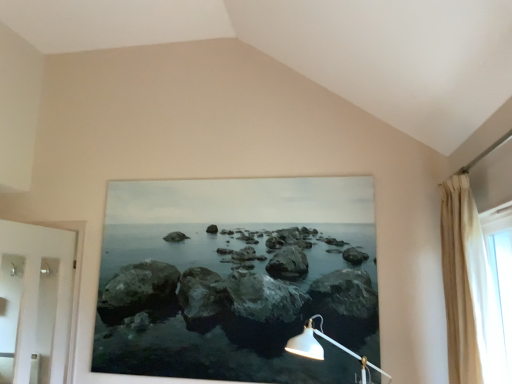
Question: Is beige fabric curtain at right to the right of white glossy door at left from the viewer's perspective?

Choices:
 (A) yes
 (B) no

Answer: (A)

Question: Considering the relative sizes of beige fabric curtain at right and white glossy door at left in the image provided, is beige fabric curtain at right bigger than white glossy door at left?

Choices:
 (A) no
 (B) yes

Answer: (A)

Question: Is beige fabric curtain at right shorter than white glossy door at left?

Choices:
 (A) yes
 (B) no

Answer: (A)

Question: Does beige fabric curtain at right appear on the left side of white glossy door at left?

Choices:
 (A) no
 (B) yes

Answer: (A)

Question: Is beige fabric curtain at right next to white glossy door at left and touching it?

Choices:
 (A) no
 (B) yes

Answer: (A)

Question: Is beige fabric curtain at right closer to the viewer compared to white glossy door at left?

Choices:
 (A) yes
 (B) no

Answer: (A)

Question: Does white glossy door at left have a lesser width compared to beige fabric curtain at right?

Choices:
 (A) no
 (B) yes

Answer: (B)

Question: From the image's perspective, does white glossy door at left appear higher than beige fabric curtain at right?

Choices:
 (A) yes
 (B) no

Answer: (B)

Question: Would you say white glossy door at left is a long distance from beige fabric curtain at right?

Choices:
 (A) no
 (B) yes

Answer: (B)

Question: Is the surface of white glossy door at left in direct contact with beige fabric curtain at right?

Choices:
 (A) no
 (B) yes

Answer: (A)

Question: From a real-world perspective, is white glossy door at left below beige fabric curtain at right?

Choices:
 (A) no
 (B) yes

Answer: (B)

Question: From a real-world perspective, is white glossy door at left positioned over beige fabric curtain at right based on gravity?

Choices:
 (A) no
 (B) yes

Answer: (A)

Question: Does translucent fabric curtain at right contain white glossy door at left?

Choices:
 (A) no
 (B) yes

Answer: (A)